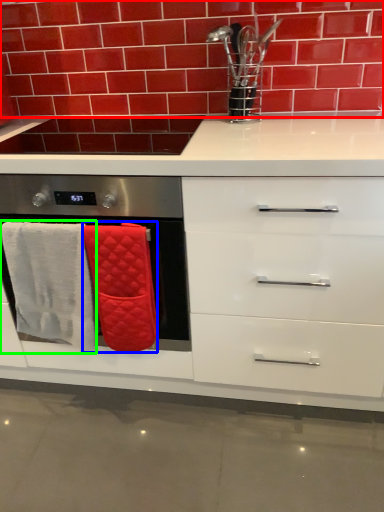
Question: Estimate the real-world distances between objects in this image. Which object is farther from brick (highlighted by a red box), bath towel (highlighted by a blue box) or bath towel (highlighted by a green box)?

Choices:
 (A) bath towel
 (B) bath towel

Answer: (A)